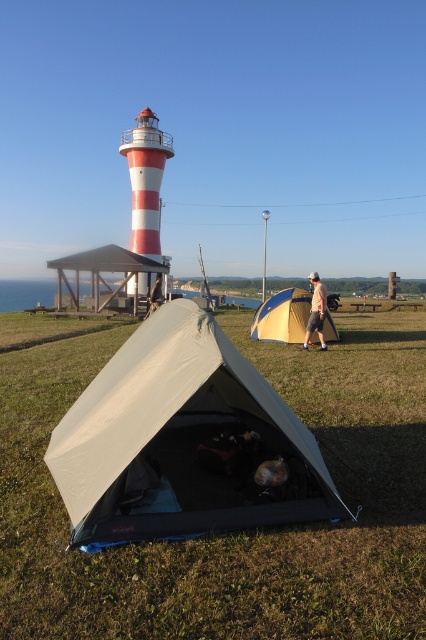
You are setting up a campsite and need to retrieve your light brown leather jacket at center. The matte gray tent at center is in your way. Can you reach the jacket without moving the tent?

The matte gray tent at center is positioned under light brown leather jacket at center, so the jacket is above the tent. You can reach the jacket without moving the tent by accessing it from above or the sides since it is placed over the tent.

You are standing at the point marked by the coordinates point (106, 269), which is the white plastic tent at center. You want to walk towards the motorcycle parked near the yellow and blue tent. Which direction should you go?

The white plastic tent at center is marked by point (106, 269). To reach the motorcycle parked near the yellow and blue tent, you should walk towards the right direction from the white plastic tent at center since the yellow and blue tent with the motorcycle is positioned further back in the scene to the right of the beige tent.

You are a hiker who wants to retrieve your light brown leather jacket from the camping area. You are currently standing near the matte gray tent at center. Which direction should you move to reach the light brown leather jacket at center?

The light brown leather jacket at center is behind the matte gray tent at center, so you should move backward away from the camera to reach it.